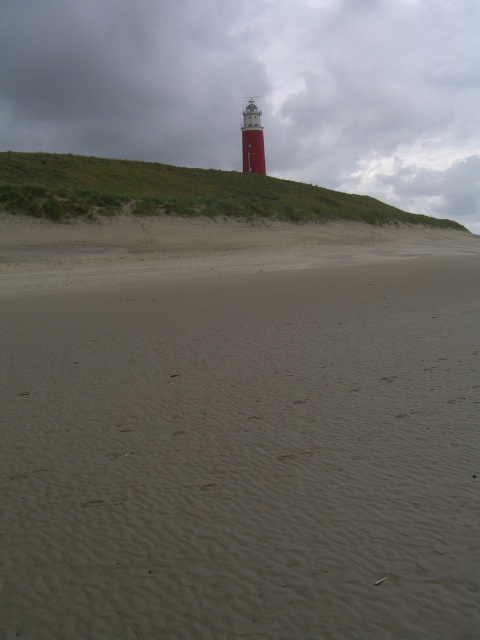
Question: Which object appears closest to the camera in this image?

Choices:
 (A) green grassy hillside at upper center
 (B) smooth red lighthouse at center

Answer: (A)

Question: Can you confirm if smooth beige sand at center is positioned to the left of green grassy hillside at upper center?

Choices:
 (A) no
 (B) yes

Answer: (B)

Question: Which of these objects is positioned closest to the smooth beige sand at center?

Choices:
 (A) smooth red lighthouse at center
 (B) green grassy hillside at upper center

Answer: (B)

Question: Does green grassy hillside at upper center appear on the right side of smooth red lighthouse at center?

Choices:
 (A) no
 (B) yes

Answer: (B)

Question: Observing the image, what is the correct spatial positioning of smooth beige sand at center in reference to smooth red lighthouse at center?

Choices:
 (A) above
 (B) below

Answer: (B)

Question: Among these points, which one is nearest to the camera?

Choices:
 (A) (64, 531)
 (B) (248, 172)
 (C) (45, 186)

Answer: (A)